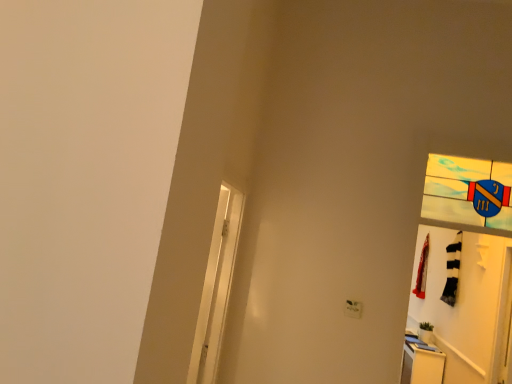
Question: From a real-world perspective, is white glossy screen door at left on red fabric laundry at right?

Choices:
 (A) no
 (B) yes

Answer: (A)

Question: Is white glossy screen door at left oriented away from red fabric laundry at right?

Choices:
 (A) no
 (B) yes

Answer: (A)

Question: Is white glossy screen door at left further to the viewer compared to red fabric laundry at right?

Choices:
 (A) yes
 (B) no

Answer: (B)

Question: Considering the relative sizes of white glossy screen door at left and red fabric laundry at right in the image provided, is white glossy screen door at left wider than red fabric laundry at right?

Choices:
 (A) yes
 (B) no

Answer: (B)

Question: Can you confirm if white glossy screen door at left is thinner than red fabric laundry at right?

Choices:
 (A) no
 (B) yes

Answer: (B)

Question: Looking at their shapes, would you say white glossy dresser at lower right is wider or thinner than white matte door at right?

Choices:
 (A) thin
 (B) wide

Answer: (B)

Question: Is point (443, 367) positioned closer to the camera than point (490, 309)?

Choices:
 (A) farther
 (B) closer

Answer: (A)

Question: Would you say white glossy dresser at lower right is to the left or to the right of white matte door at right in the picture?

Choices:
 (A) left
 (B) right

Answer: (B)

Question: From a real-world perspective, relative to white matte door at right, is white glossy dresser at lower right vertically above or below?

Choices:
 (A) above
 (B) below

Answer: (B)

Question: Considering the positions of red fabric laundry at right and white glossy screen door at left in the image, is red fabric laundry at right bigger or smaller than white glossy screen door at left?

Choices:
 (A) small
 (B) big

Answer: (B)

Question: From their relative heights in the image, would you say red fabric laundry at right is taller or shorter than white glossy screen door at left?

Choices:
 (A) short
 (B) tall

Answer: (A)

Question: From a real-world perspective, relative to white glossy screen door at left, is red fabric laundry at right vertically above or below?

Choices:
 (A) above
 (B) below

Answer: (A)

Question: Does point (421, 248) appear closer or farther from the camera than point (218, 339)?

Choices:
 (A) closer
 (B) farther

Answer: (B)

Question: Is white plastic electric outlet at lower right in front of or behind red fabric laundry at right in the image?

Choices:
 (A) behind
 (B) front

Answer: (B)

Question: Considering the positions of point (352, 309) and point (423, 294), is point (352, 309) closer or farther from the camera than point (423, 294)?

Choices:
 (A) closer
 (B) farther

Answer: (A)